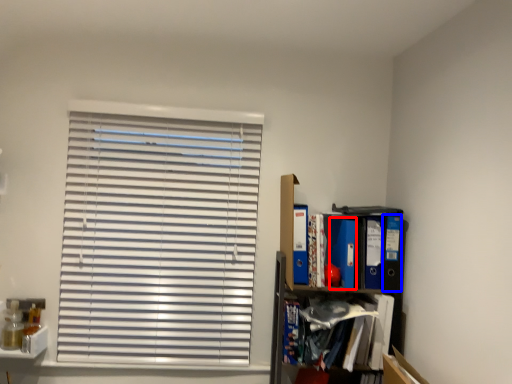
Question: Which of the following is the farthest to the observer, paperback book (highlighted by a red box) or paperback book (highlighted by a blue box)?

Choices:
 (A) paperback book
 (B) paperback book

Answer: (A)